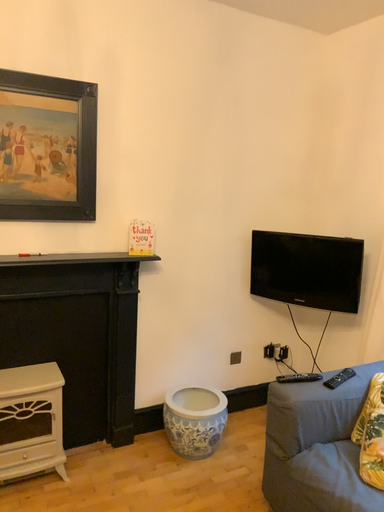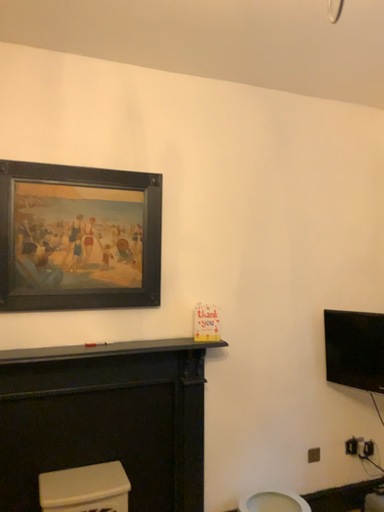
Question: Which way did the camera rotate in the video?

Choices:
 (A) rotated upward
 (B) rotated downward

Answer: (A)